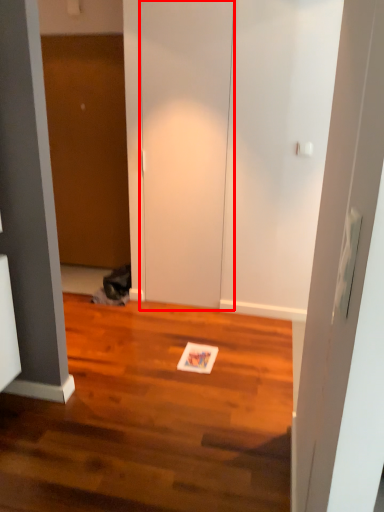
Question: Considering the relative positions of door (annotated by the red box) and door in the image provided, where is door (annotated by the red box) located with respect to the staircase?

Choices:
 (A) left
 (B) right

Answer: (B)